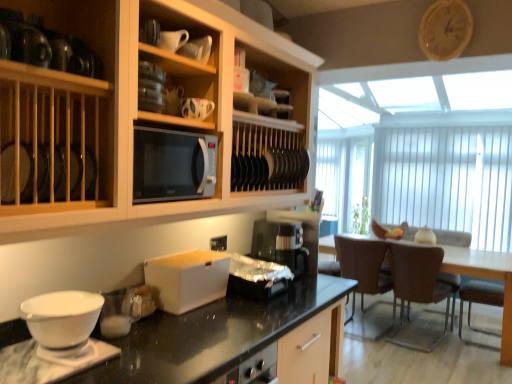
Question: Are brown leather armchair at right, which ranks as the second armchair in front-to-back order, and brown leather chair at right, acting as the 1th chair starting from the left, beside each other?

Choices:
 (A) yes
 (B) no

Answer: (B)

Question: Is brown leather armchair at right, positioned as the 1th armchair in back-to-front order, outside of brown leather chair at right, acting as the 1th chair starting from the left?

Choices:
 (A) yes
 (B) no

Answer: (A)

Question: Does brown leather armchair at right, which ranks as the second armchair in front-to-back order, appear on the right side of brown leather chair at right, acting as the 1th chair starting from the left?

Choices:
 (A) yes
 (B) no

Answer: (A)

Question: Would you say brown leather armchair at right, which ranks as the second armchair in front-to-back order, contains brown leather chair at right, the 2th chair viewed from the right?

Choices:
 (A) yes
 (B) no

Answer: (B)

Question: Is brown leather armchair at right, positioned as the 1th armchair in back-to-front order, oriented towards brown leather chair at right, the 2th chair viewed from the right?

Choices:
 (A) yes
 (B) no

Answer: (B)

Question: From a real-world perspective, is brown leather armchair at right, positioned as the 1th armchair in back-to-front order, physically below brown leather chair at right, acting as the 1th chair starting from the left?

Choices:
 (A) no
 (B) yes

Answer: (A)

Question: From the image's perspective, is matte ceramic mug at upper center, positioned as the 1th tableware in top-to-bottom order, above wooden clock at upper right?

Choices:
 (A) no
 (B) yes

Answer: (A)

Question: Is matte ceramic mug at upper center, which is counted as the 1th tableware, starting from the front, at the left side of wooden clock at upper right?

Choices:
 (A) yes
 (B) no

Answer: (A)

Question: From a real-world perspective, is matte ceramic mug at upper center, the second tableware positioned from the back, under wooden clock at upper right?

Choices:
 (A) no
 (B) yes

Answer: (B)

Question: Are matte ceramic mug at upper center, which is counted as the 1th tableware, starting from the front, and wooden clock at upper right located far from each other?

Choices:
 (A) yes
 (B) no

Answer: (A)

Question: Considering the relative sizes of matte ceramic mug at upper center, positioned as the 1th tableware in top-to-bottom order, and wooden clock at upper right in the image provided, is matte ceramic mug at upper center, positioned as the 1th tableware in top-to-bottom order, smaller than wooden clock at upper right?

Choices:
 (A) no
 (B) yes

Answer: (B)

Question: Does matte ceramic mug at upper center, which is counted as the 1th tableware, starting from the front, have a lesser width compared to wooden clock at upper right?

Choices:
 (A) no
 (B) yes

Answer: (A)

Question: Does white matte bowl at lower left have a lesser width compared to brown leather armchair at right, positioned as the 1th armchair in back-to-front order?

Choices:
 (A) no
 (B) yes

Answer: (B)